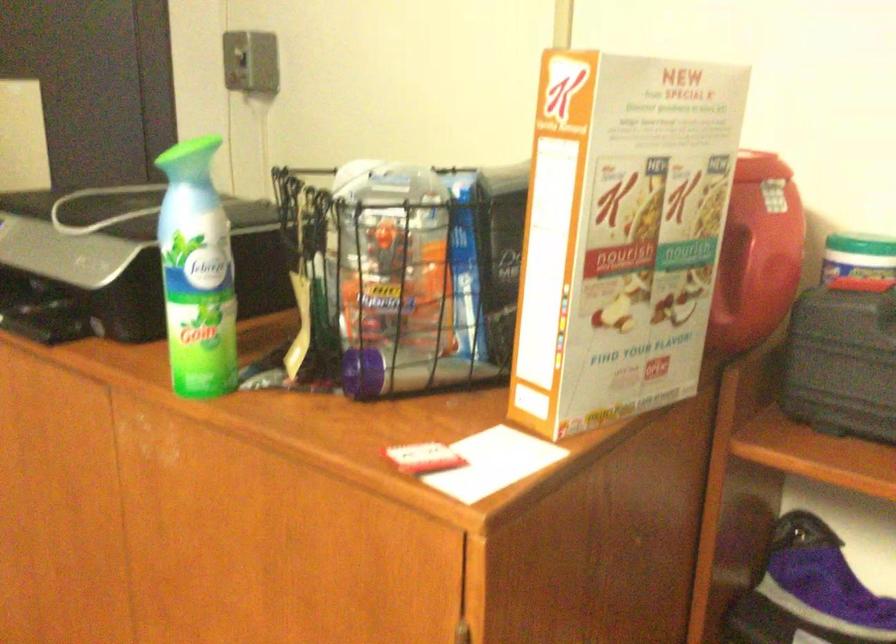
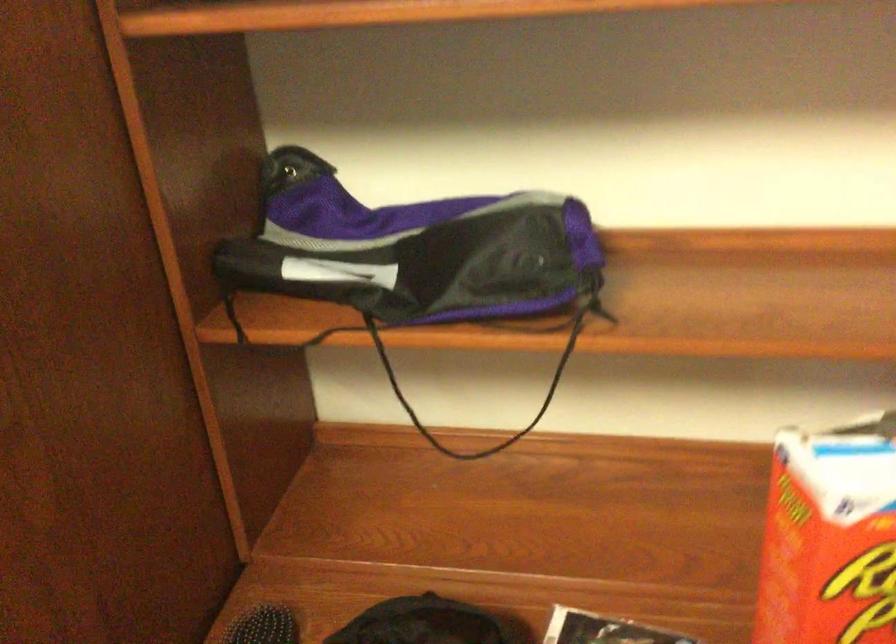
Question: The camera is either moving clockwise (left) or counter-clockwise (right) around the object. The first image is from the beginning of the video and the second image is from the end. Is the camera moving left or right when shooting the video?

Choices:
 (A) Left
 (B) Right

Answer: (A)